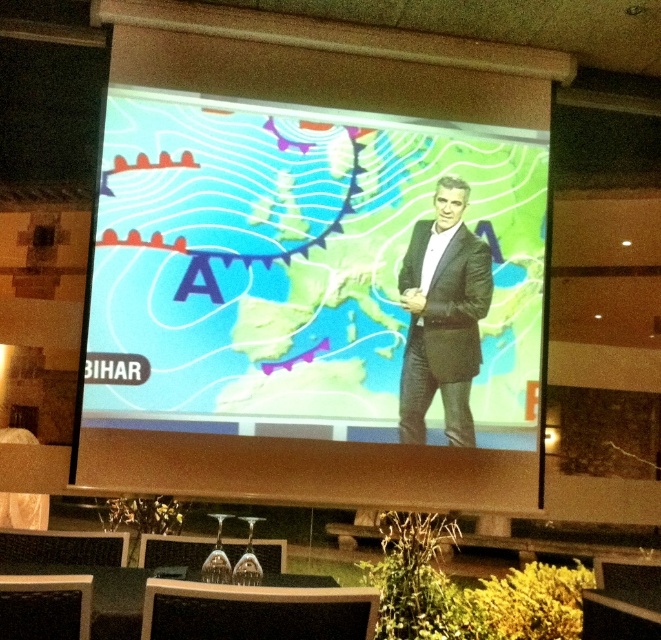
Question: Which point appears closest to the camera in this image?

Choices:
 (A) (198, 291)
 (B) (475, 253)

Answer: (A)

Question: Does matte plastic screen at center have a greater width compared to dark gray suit at center?

Choices:
 (A) yes
 (B) no

Answer: (A)

Question: Does matte plastic screen at center appear on the right side of dark gray suit at center?

Choices:
 (A) no
 (B) yes

Answer: (A)

Question: Which of the following is the farthest from the observer?

Choices:
 (A) (440, 266)
 (B) (395, 156)

Answer: (B)

Question: From the image, what is the correct spatial relationship of matte plastic screen at center in relation to dark gray suit at center?

Choices:
 (A) below
 (B) above

Answer: (B)